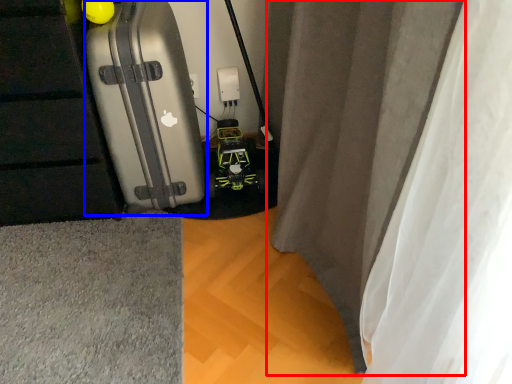
Question: Which of the following is the farthest to the observer, curtain (highlighted by a red box) or suitcase (highlighted by a blue box)?

Choices:
 (A) curtain
 (B) suitcase

Answer: (B)